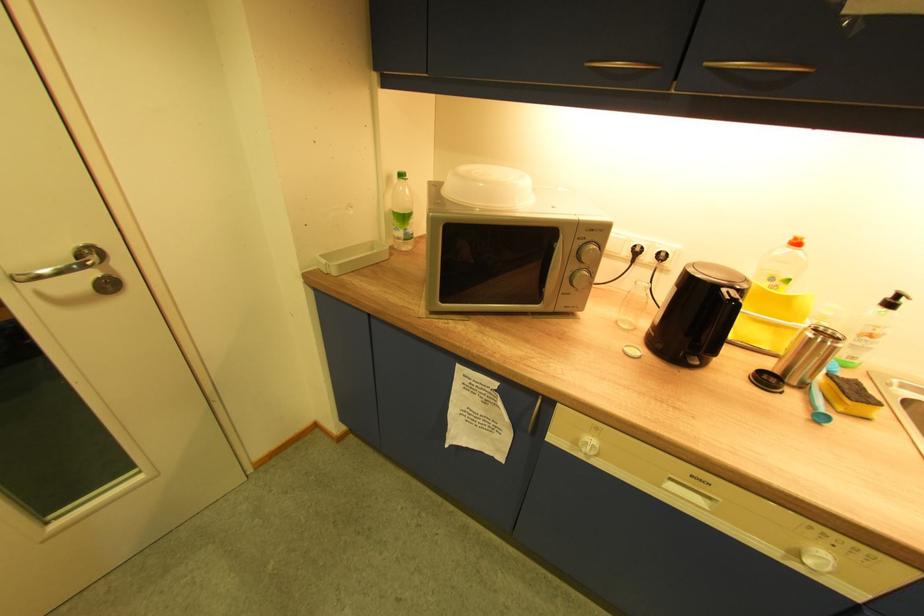
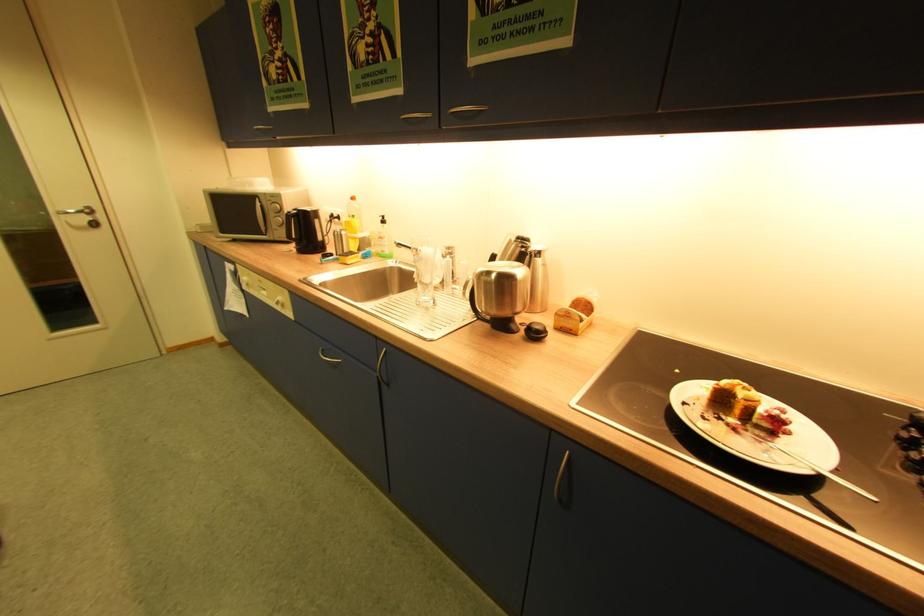
In the second image, find the point that corresponds to [890,310] in the first image.

(386, 225)